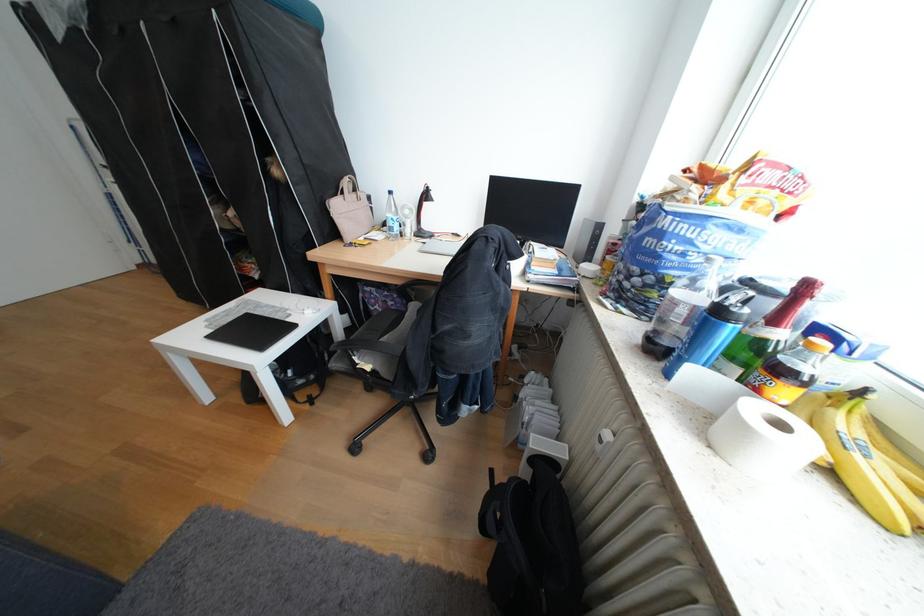
In order to click on clear water bottle in this screenshot , I will do `click(681, 309)`.